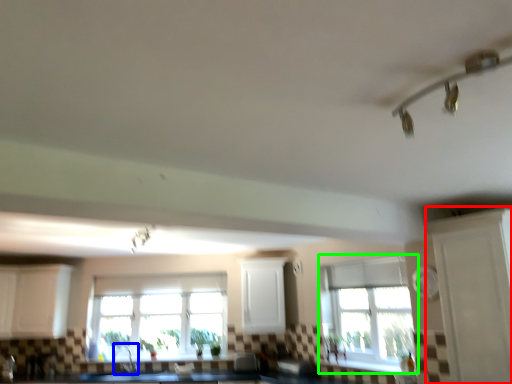
Question: Which is nearer to the glass door (highlighted by a red box)? faucet (highlighted by a blue box) or window (highlighted by a green box).

Choices:
 (A) faucet
 (B) window

Answer: (B)